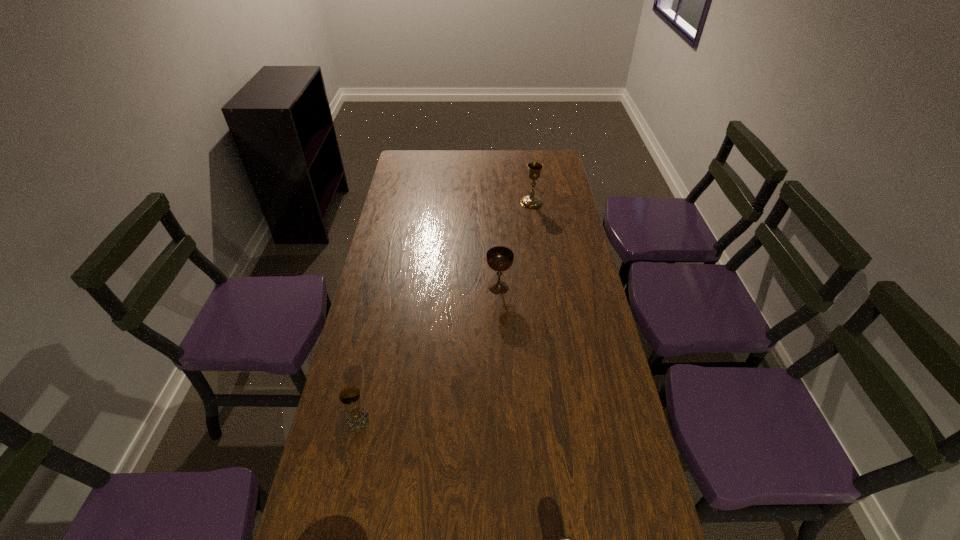
Identify which object is located as the nearest to the beer can. Please provide its 2D coordinates. Your answer should be formatted as a tuple, i.e. [(x, y)], where the tuple contains the x and y coordinates of a point satisfying the conditions above.

[(350, 396)]

Where is `chalice that is the second closest to the third farthest object`? The height and width of the screenshot is (540, 960). chalice that is the second closest to the third farthest object is located at coordinates (529, 201).

At what (x,y) coordinates should I click in order to perform the action: click on chalice object that ranks as the closest to the farthest chalice. Please return your answer as a coordinate pair (x, y). Image resolution: width=960 pixels, height=540 pixels. Looking at the image, I should click on (499, 258).